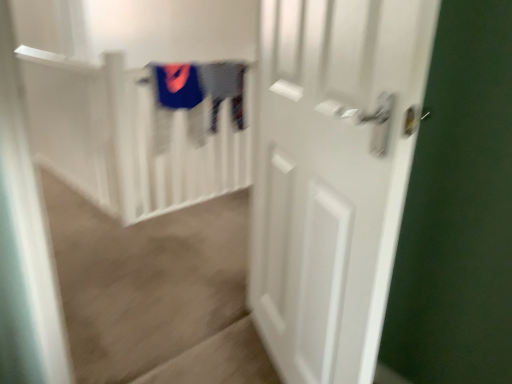
At what (x,y) coordinates should I click in order to perform the action: click on gray cotton sweater at upper center, the second clothing from the left. Please return your answer as a coordinate pair (x, y). Looking at the image, I should click on (224, 89).

Locate an element on the screen. This screenshot has width=512, height=384. white matte stair railing at upper center is located at coordinates (156, 292).

Which object is closer to the camera taking this photo, gray cotton sweater at upper center, the second clothing from the left, or white matte stair railing at upper center?

white matte stair railing at upper center is more forward.

I want to click on the 1st clothing above when counting from the white matte stair railing at upper center (from the image's perspective), so click(224, 89).

Could you tell me if gray cotton sweater at upper center, the second clothing from the left, is facing white matte stair railing at upper center?

No, gray cotton sweater at upper center, the second clothing from the left, is not facing towards white matte stair railing at upper center.

Considering the sizes of gray cotton sweater at upper center, the second clothing from the left, and white matte stair railing at upper center in the image, is gray cotton sweater at upper center, the second clothing from the left, bigger or smaller than white matte stair railing at upper center?

gray cotton sweater at upper center, the second clothing from the left, is smaller than white matte stair railing at upper center.

Where is `plain lying in front of the velvet blue sweater at upper center, positioned as the 2th clothing in right-to-left order`? plain lying in front of the velvet blue sweater at upper center, positioned as the 2th clothing in right-to-left order is located at coordinates (156, 292).

Does white matte stair railing at upper center lie behind velvet blue sweater at upper center, positioned as the 2th clothing in right-to-left order?

No, white matte stair railing at upper center is closer to the camera.

Is white matte stair railing at upper center not within velvet blue sweater at upper center, which is counted as the first clothing, starting from the left?

Yes, white matte stair railing at upper center is located beyond the bounds of velvet blue sweater at upper center, which is counted as the first clothing, starting from the left.

Does white matte door at right turn towards white matte stair railing at upper center?

No, white matte door at right is not turned towards white matte stair railing at upper center.

Between point (348, 264) and point (100, 358), which one is positioned in front?

The point (348, 264) is closer to the camera.

Is white matte door at right not close to white matte stair railing at upper center?

No, white matte door at right is not far from white matte stair railing at upper center.

Image resolution: width=512 pixels, height=384 pixels. In order to click on plain located on the left of white matte door at right in this screenshot , I will do `click(156, 292)`.

Does gray cotton sweater at upper center, which is the first clothing from right to left, turn towards velvet blue sweater at upper center, which is counted as the first clothing, starting from the left?

No.

From a real-world perspective, is gray cotton sweater at upper center, the second clothing from the left, below velvet blue sweater at upper center, positioned as the 2th clothing in right-to-left order?

Indeed, from a real-world perspective, gray cotton sweater at upper center, the second clothing from the left, is positioned beneath velvet blue sweater at upper center, positioned as the 2th clothing in right-to-left order.

Is gray cotton sweater at upper center, the second clothing from the left, at the right side of velvet blue sweater at upper center, which is counted as the first clothing, starting from the left?

Indeed, gray cotton sweater at upper center, the second clothing from the left, is positioned on the right side of velvet blue sweater at upper center, which is counted as the first clothing, starting from the left.

From the picture: Which object is thinner, gray cotton sweater at upper center, the second clothing from the left, or velvet blue sweater at upper center, positioned as the 2th clothing in right-to-left order?

With smaller width is velvet blue sweater at upper center, positioned as the 2th clothing in right-to-left order.

Would you say velvet blue sweater at upper center, which is counted as the first clothing, starting from the left, contains gray cotton sweater at upper center, the second clothing from the left?

No.

Who is taller, velvet blue sweater at upper center, positioned as the 2th clothing in right-to-left order, or gray cotton sweater at upper center, the second clothing from the left?

gray cotton sweater at upper center, the second clothing from the left, is taller.

From a real-world perspective, does velvet blue sweater at upper center, which is counted as the first clothing, starting from the left, sit lower than gray cotton sweater at upper center, which is the first clothing from right to left?

No, from a real-world perspective, velvet blue sweater at upper center, which is counted as the first clothing, starting from the left, is not beneath gray cotton sweater at upper center, which is the first clothing from right to left.

Measure the distance between velvet blue sweater at upper center, which is counted as the first clothing, starting from the left, and gray cotton sweater at upper center, which is the first clothing from right to left.

velvet blue sweater at upper center, which is counted as the first clothing, starting from the left, is 7.53 inches away from gray cotton sweater at upper center, which is the first clothing from right to left.

Can you confirm if white matte door at right is taller than velvet blue sweater at upper center, positioned as the 2th clothing in right-to-left order?

Yes, white matte door at right is taller than velvet blue sweater at upper center, positioned as the 2th clothing in right-to-left order.

From the image's perspective, is white matte door at right positioned above or below velvet blue sweater at upper center, which is counted as the first clothing, starting from the left?

Clearly, from the image's perspective, white matte door at right is below velvet blue sweater at upper center, which is counted as the first clothing, starting from the left.

Is white matte door at right at the right side of velvet blue sweater at upper center, which is counted as the first clothing, starting from the left?

Yes.

In the scene shown: How many degrees apart are the facing directions of white matte door at right and velvet blue sweater at upper center, which is counted as the first clothing, starting from the left?

The facing directions of white matte door at right and velvet blue sweater at upper center, which is counted as the first clothing, starting from the left, are 115 degrees apart.

Is white matte stair railing at upper center to the right of white matte door at right from the viewer's perspective?

Incorrect, white matte stair railing at upper center is not on the right side of white matte door at right.

The height and width of the screenshot is (384, 512). I want to click on plain behind the white matte door at right, so click(156, 292).

From a real-world perspective, which object stands above the other?

white matte door at right is physically above.

Considering the relative sizes of white matte stair railing at upper center and white matte door at right in the image provided, is white matte stair railing at upper center smaller than white matte door at right?

No, white matte stair railing at upper center is not smaller than white matte door at right.

Identify the location of plain in front of the gray cotton sweater at upper center, which is the first clothing from right to left. (156, 292).

Identify the location of plain below the velvet blue sweater at upper center, which is counted as the first clothing, starting from the left (from a real-world perspective). (156, 292).

Looking at this image, when comparing their distances from gray cotton sweater at upper center, the second clothing from the left, does white matte door at right or white matte stair railing at upper center seem further?

white matte door at right lies further to gray cotton sweater at upper center, the second clothing from the left, than the other object.

Based on the photo, looking at the image, which one is located closer to white matte stair railing at upper center, white matte door at right or gray cotton sweater at upper center, the second clothing from the left?

Based on the image, white matte door at right appears to be nearer to white matte stair railing at upper center.

From the picture: Looking at the image, which one is located closer to white matte door at right, velvet blue sweater at upper center, positioned as the 2th clothing in right-to-left order, or white matte stair railing at upper center?

white matte stair railing at upper center.

Based on their spatial positions, is velvet blue sweater at upper center, which is counted as the first clothing, starting from the left, or white matte door at right further from gray cotton sweater at upper center, which is the first clothing from right to left?

Based on the image, white matte door at right appears to be further to gray cotton sweater at upper center, which is the first clothing from right to left.

Estimate the real-world distances between objects in this image. Which object is further from velvet blue sweater at upper center, positioned as the 2th clothing in right-to-left order, white matte door at right or white matte stair railing at upper center?

white matte door at right is further to velvet blue sweater at upper center, positioned as the 2th clothing in right-to-left order.

From the picture: Considering their positions, is white matte door at right positioned further to gray cotton sweater at upper center, which is the first clothing from right to left, than velvet blue sweater at upper center, which is counted as the first clothing, starting from the left?

white matte door at right.

Estimate the real-world distances between objects in this image. Which object is closer to white matte stair railing at upper center, white matte door at right or velvet blue sweater at upper center, which is counted as the first clothing, starting from the left?

white matte door at right.

Considering their positions, is white matte stair railing at upper center positioned closer to white matte door at right than velvet blue sweater at upper center, positioned as the 2th clothing in right-to-left order?

white matte stair railing at upper center is closer to white matte door at right.

Identify the location of plain located between white matte door at right and gray cotton sweater at upper center, which is the first clothing from right to left, in the depth direction. (156, 292).

Where is `clothing between white matte door at right and gray cotton sweater at upper center, the second clothing from the left, along the z-axis`? The image size is (512, 384). clothing between white matte door at right and gray cotton sweater at upper center, the second clothing from the left, along the z-axis is located at coordinates (178, 86).

Image resolution: width=512 pixels, height=384 pixels. Identify the location of clothing between white matte stair railing at upper center and gray cotton sweater at upper center, the second clothing from the left. (178, 86).